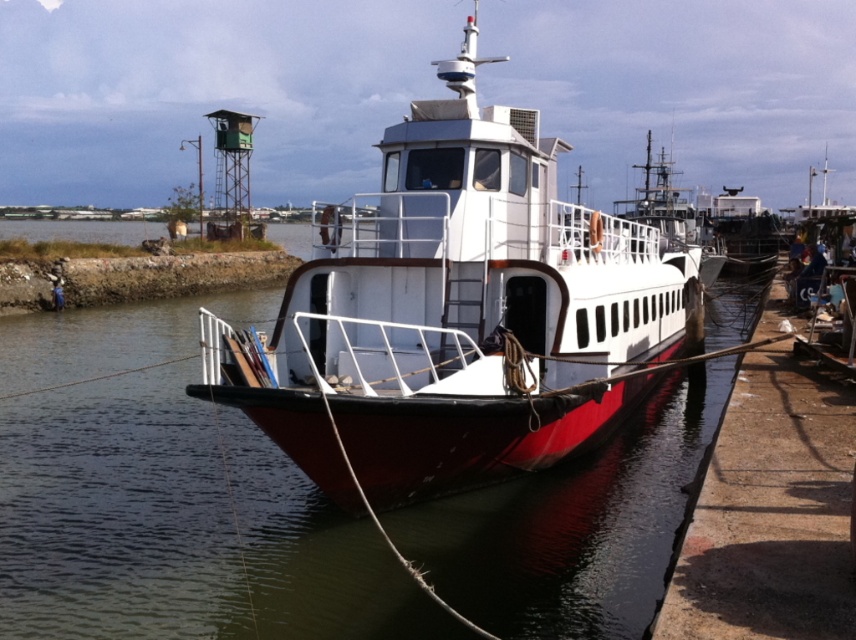
You are a dock worker who needs to move a 50 feet long cargo container from the red matte boat at center to the white glossy ferry at center. Can you safely move the container without it extending beyond the space between them?

The red matte boat at center and white glossy ferry at center are 51.21 feet apart. Since the cargo container is 50 feet long, it can be moved safely as the distance between them is sufficient to accommodate the container without overextending.